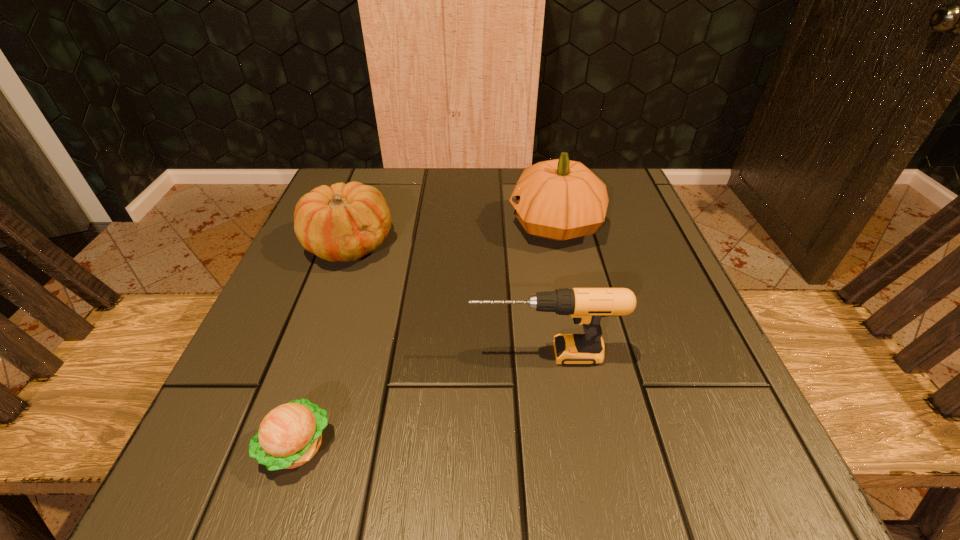
You are a GUI agent. You are given a task and a screenshot of the screen. Output one action in this format:
    pyautogui.click(x=<x>, y=<y>)
    Task: Click on the right gourd
    Image resolution: width=960 pixels, height=540 pixels.
    Given the screenshot: What is the action you would take?
    pyautogui.click(x=560, y=199)

Locate an element on the screen. Image resolution: width=960 pixels, height=540 pixels. the tallest object is located at coordinates (560, 199).

You are a GUI agent. You are given a task and a screenshot of the screen. Output one action in this format:
    pyautogui.click(x=<x>, y=<y>)
    Task: Click on the second tallest object
    Image resolution: width=960 pixels, height=540 pixels.
    Given the screenshot: What is the action you would take?
    pyautogui.click(x=586, y=306)

Locate an element on the screen. This screenshot has width=960, height=540. drill is located at coordinates click(586, 306).

The height and width of the screenshot is (540, 960). I want to click on the second shortest object, so click(x=344, y=222).

Find the location of a particular element. The height and width of the screenshot is (540, 960). the shorter gourd is located at coordinates (344, 222).

Identify the location of the shortest object. Image resolution: width=960 pixels, height=540 pixels. (290, 435).

The width and height of the screenshot is (960, 540). Find the location of `hamburger`. hamburger is located at coordinates pos(290,435).

Find the location of a particular element. free region located on the side of the taller gourd with the carved face is located at coordinates (325, 225).

Identify the location of blank space located on the side of the taller gourd with the carved face. (349, 225).